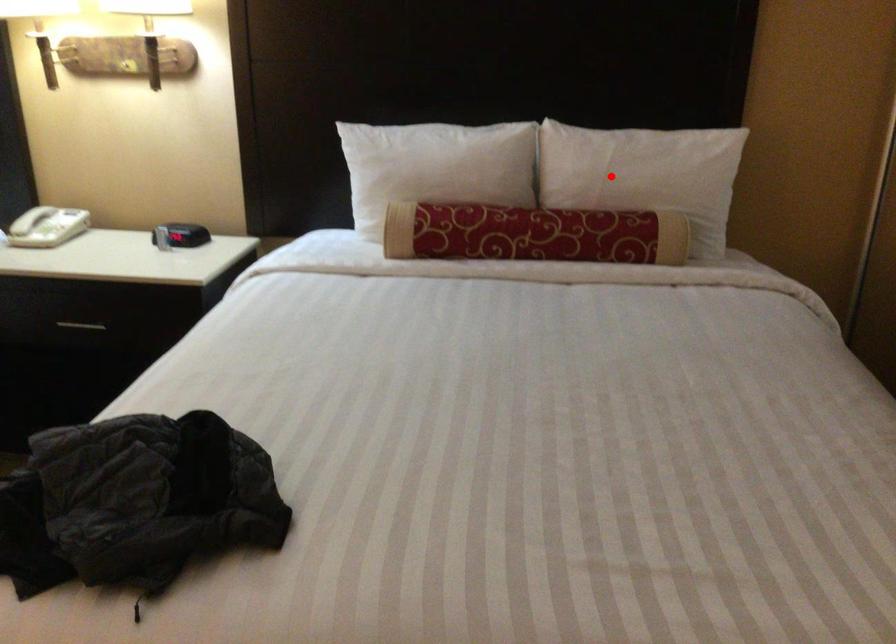
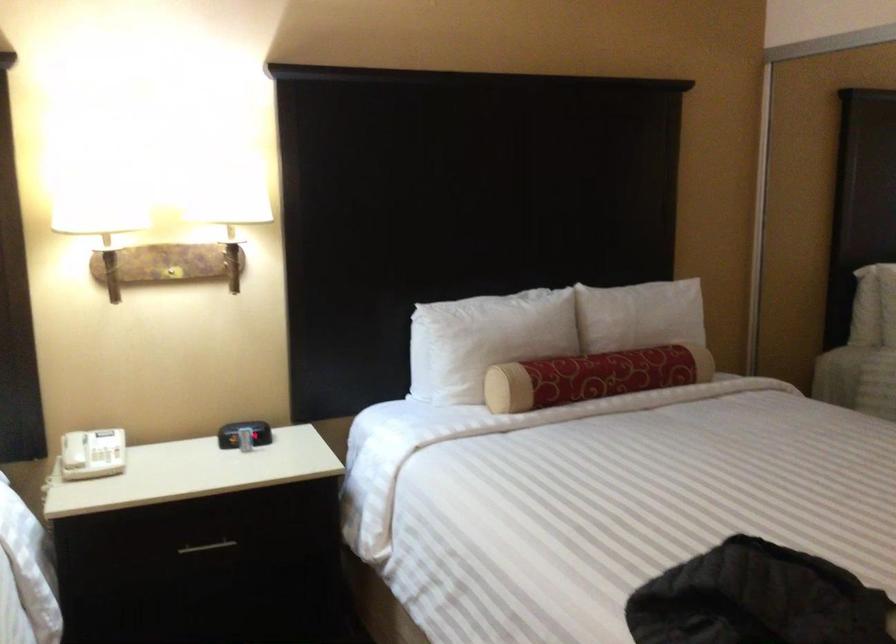
Question: I am providing you with two images of the same scene from different viewpoints. In image1, a red point is highlighted. Considering the same 3D point in image2, which of the following is correct?

Choices:
 (A) It is closer
 (B) It is farther

Answer: (B)